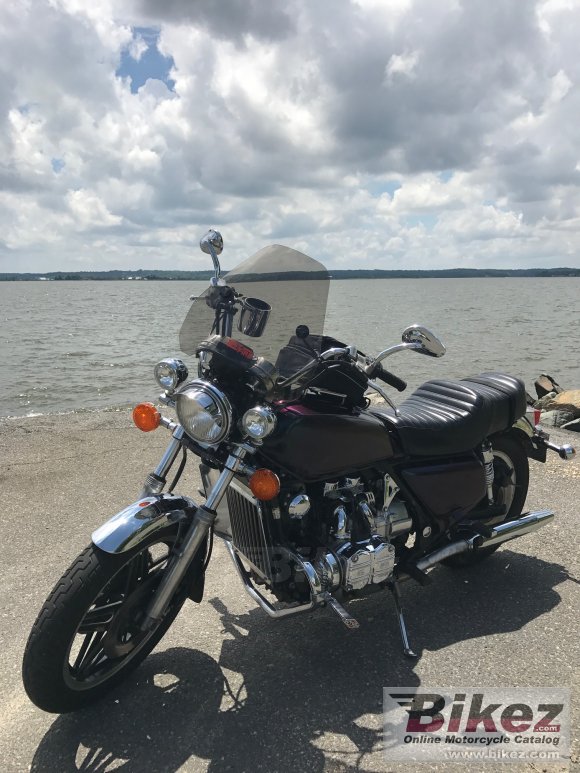
In order to click on seat in this screenshot , I will do `click(415, 431)`.